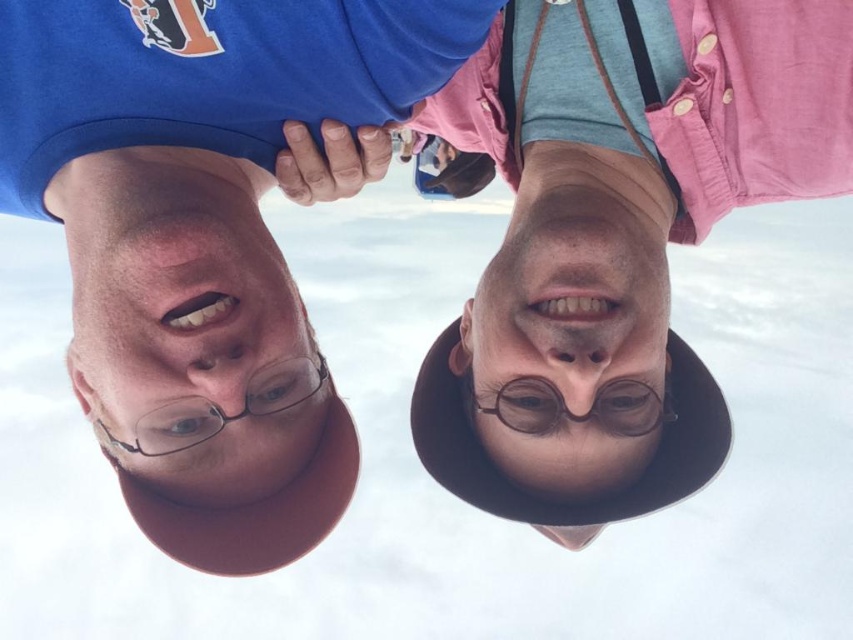
You are a photographer trying to capture a closeup shot of the matte black glasses at center. You notice the matte skin face at center is blocking part of the glasses. Based on their positions, can you adjust your angle to avoid the face?

The matte skin face at center is positioned on the left side of the matte black glasses at center. To avoid the face blocking the glasses, you should move your camera to the right side of the glasses so the face is out of frame.

You are a photographer trying to capture a clear portrait of the two people in the scene. You notice that the matte brown face at center and the matte black glasses at center are both in the frame. Which object should you focus on to ensure the subject is sharp, considering their size in the image?

The matte brown face at center has a larger size compared to the matte black glasses at center, so focusing on the matte brown face at center would ensure the subject is sharp as it is the larger and primary focus.